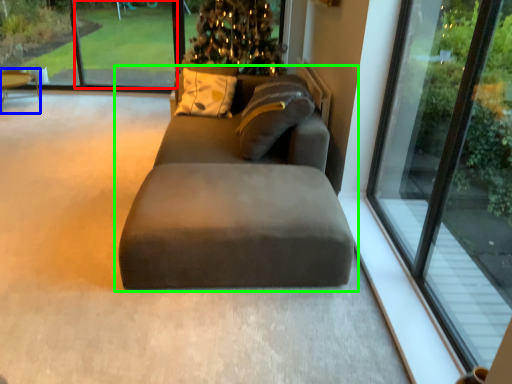
Question: Considering the real-world distances, which object is farthest from window screen (highlighted by a red box)? table (highlighted by a blue box) or studio couch (highlighted by a green box)?

Choices:
 (A) table
 (B) studio couch

Answer: (B)